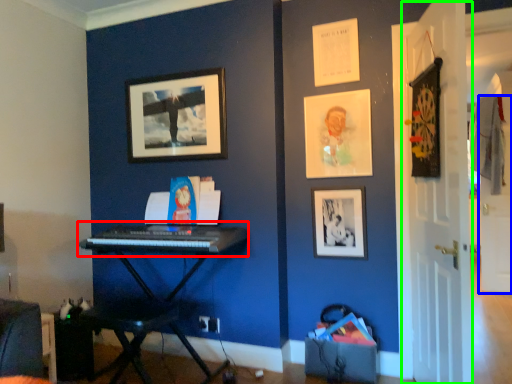
Question: Which is nearer to the musical keyboard (highlighted by a red box)? door (highlighted by a blue box) or door (highlighted by a green box).

Choices:
 (A) door
 (B) door

Answer: (B)